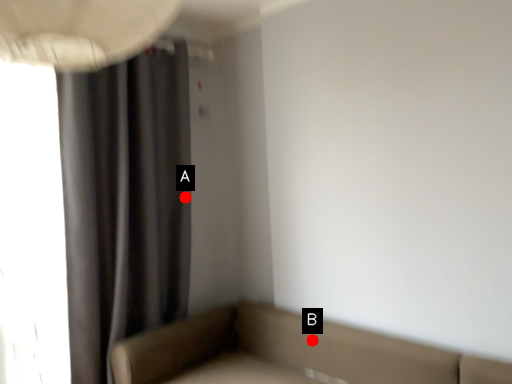
Question: Two points are circled on the image, labeled by A and B beside each circle. Which point is closer to the camera?

Choices:
 (A) A is closer
 (B) B is closer

Answer: (B)